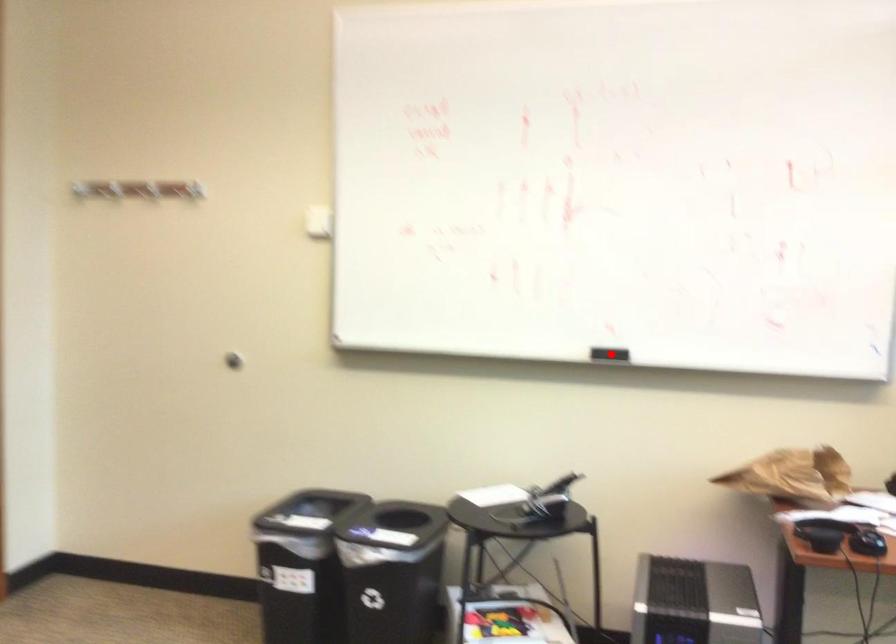
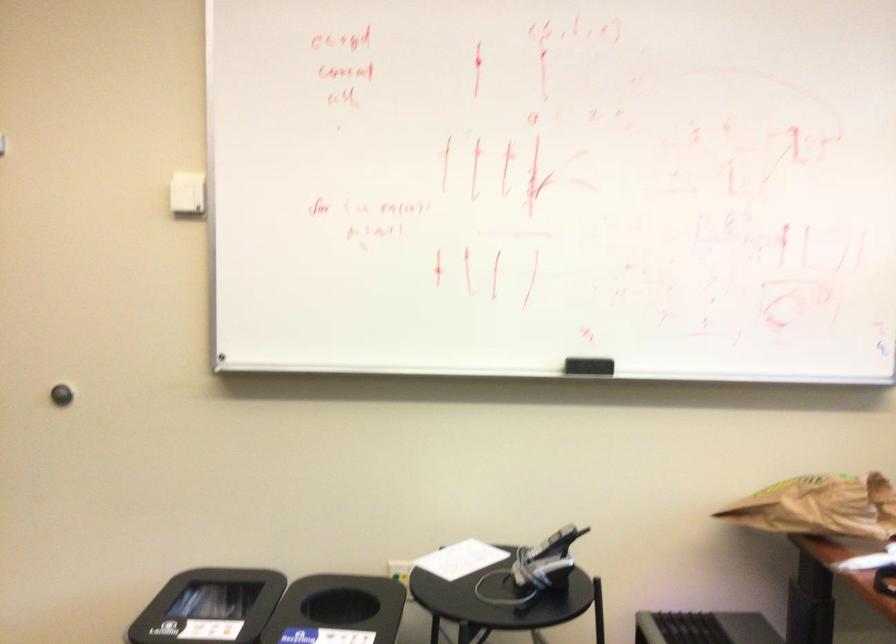
Where in the second image is the point corresponding to the highlighted location from the first image?

(588, 366)